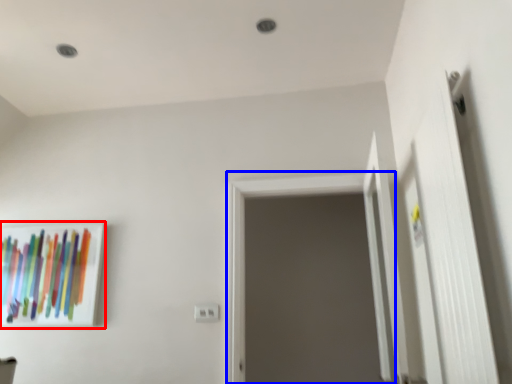
Question: Among these objects, which one is farthest to the camera, picture frame (highlighted by a red box) or screen door (highlighted by a blue box)?

Choices:
 (A) picture frame
 (B) screen door

Answer: (A)